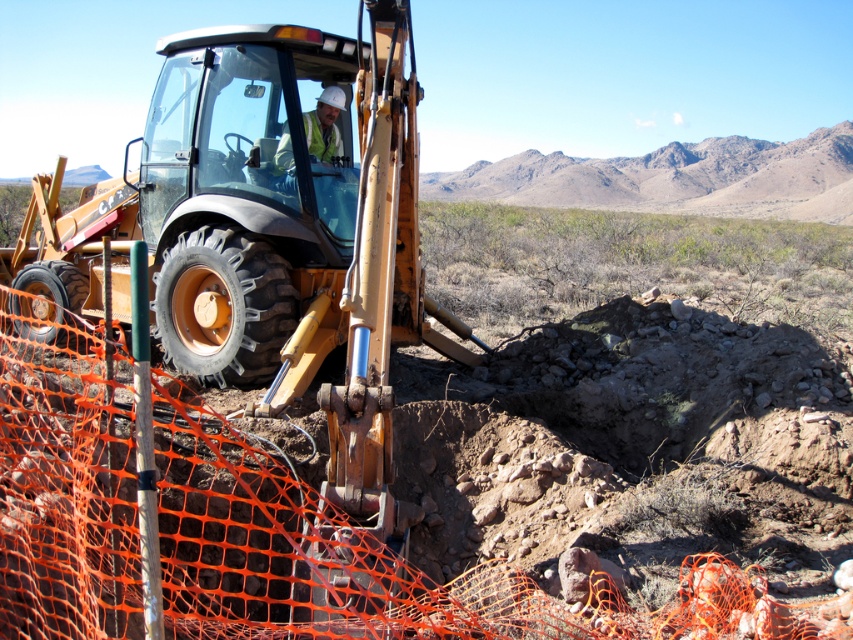
You are a safety inspector standing at the edge of the construction site. You need to check the distance between the metallic yellow tractor at center and the white hard hat at center. Based on the scene, which object is closer to you?

The metallic yellow tractor at center is closer to the viewer than the white hard hat at center.

You are a safety inspector observing the construction site. You notice the metallic yellow tractor at center and the white hard hat at center. According to safety protocols, the hard hat should be positioned above the tractor to ensure visibility. Is the current arrangement compliant with safety standards?

The metallic yellow tractor at center is located below white hard hat at center, so the white hard hat at center is positioned above the tractor. This meets the safety requirement for visibility, so the arrangement is compliant.

You are a construction supervisor standing at the origin point of the coordinate system. You need to direct a worker to the metallic yellow tractor at center. What are the coordinates to guide the worker to the tractor?

The coordinates for the metallic yellow tractor at center are at point (222, 356).